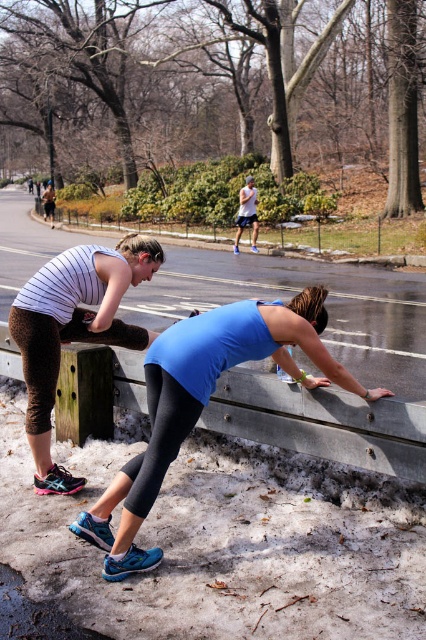
Is blue matte tank top at center thinner than matte black tank top at left?

In fact, blue matte tank top at center might be wider than matte black tank top at left.

Between blue matte tank top at center and matte black tank top at left, which one has more height?

With more height is matte black tank top at left.

Is point (218, 333) in front of point (60, 268)?

Yes, it is.

Where is `blue matte tank top at center`? blue matte tank top at center is located at coordinates (204, 403).